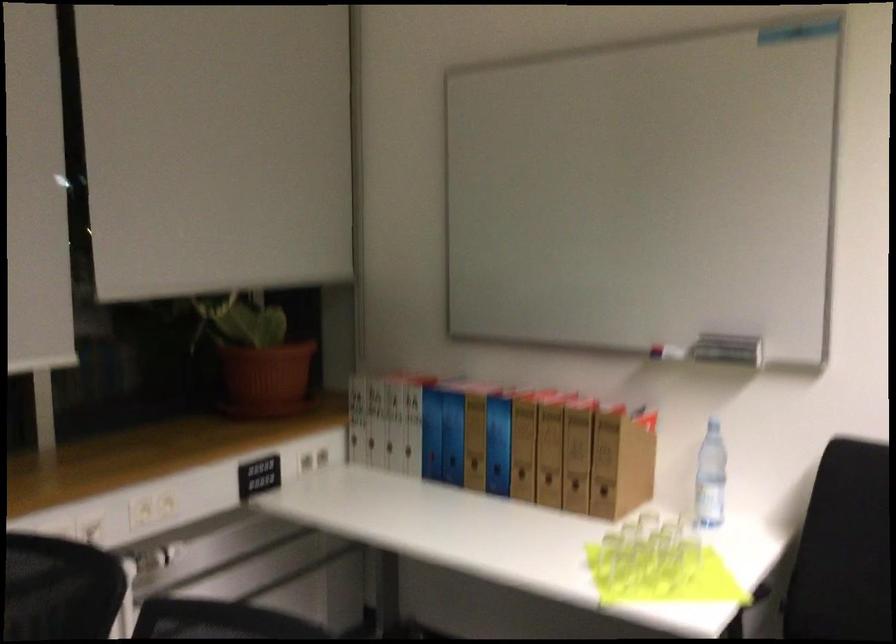
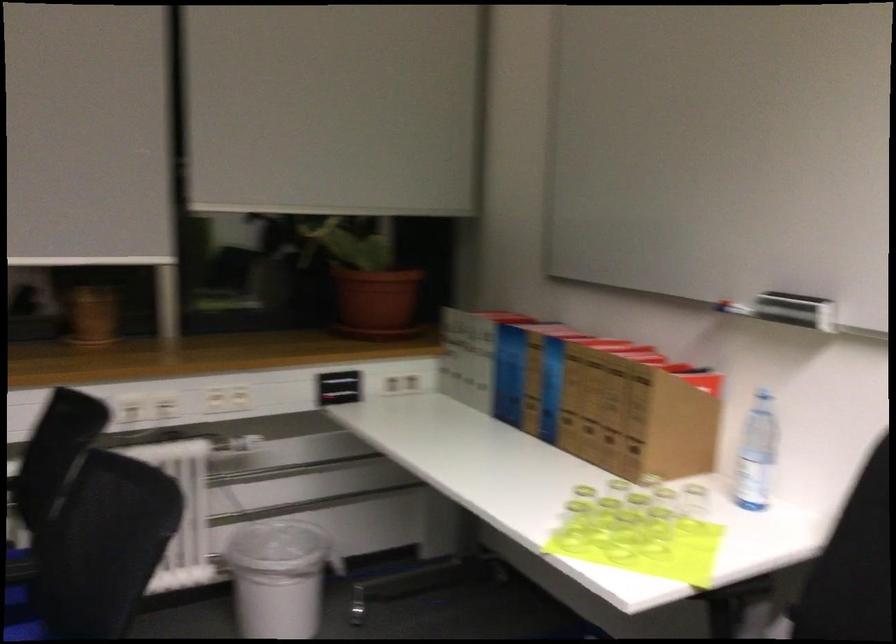
In the second image, find the point that corresponds to (x=602, y=462) in the first image.

(634, 417)